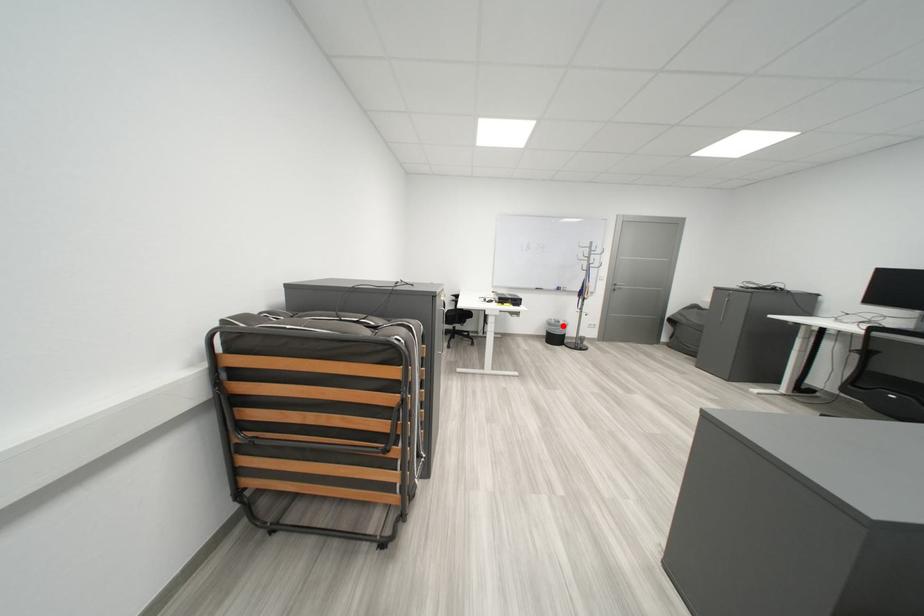
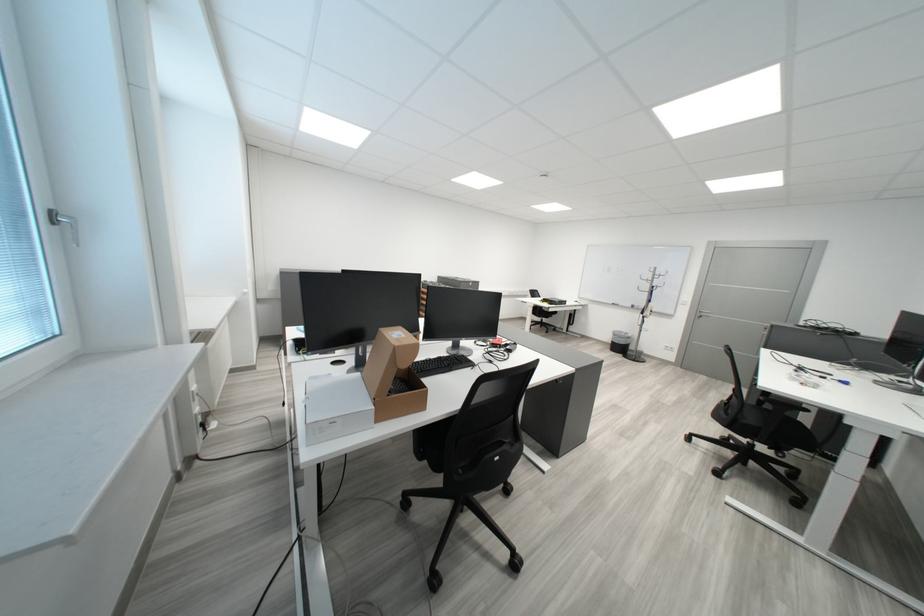
Find the pixel in the second image that matches the highlighted location in the first image.

(627, 336)